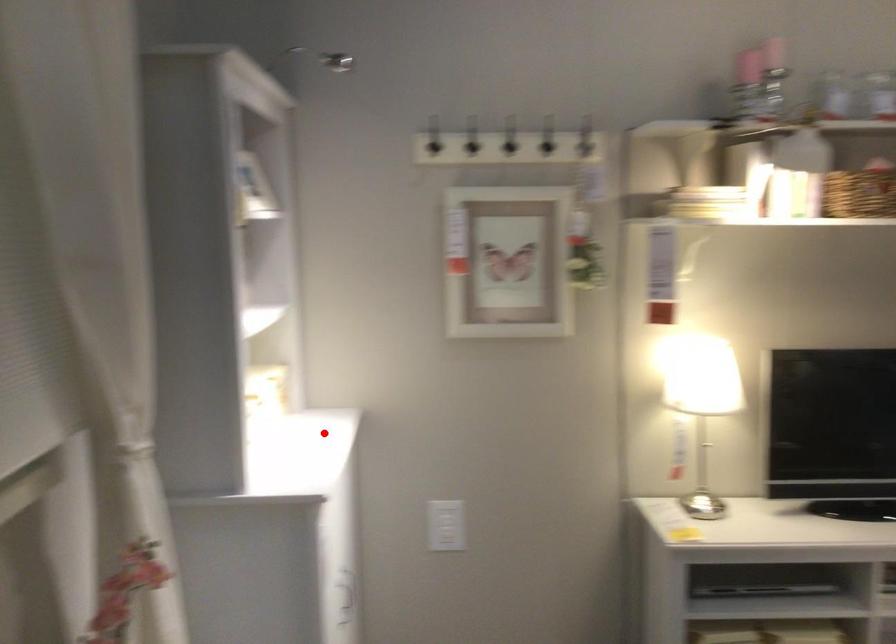
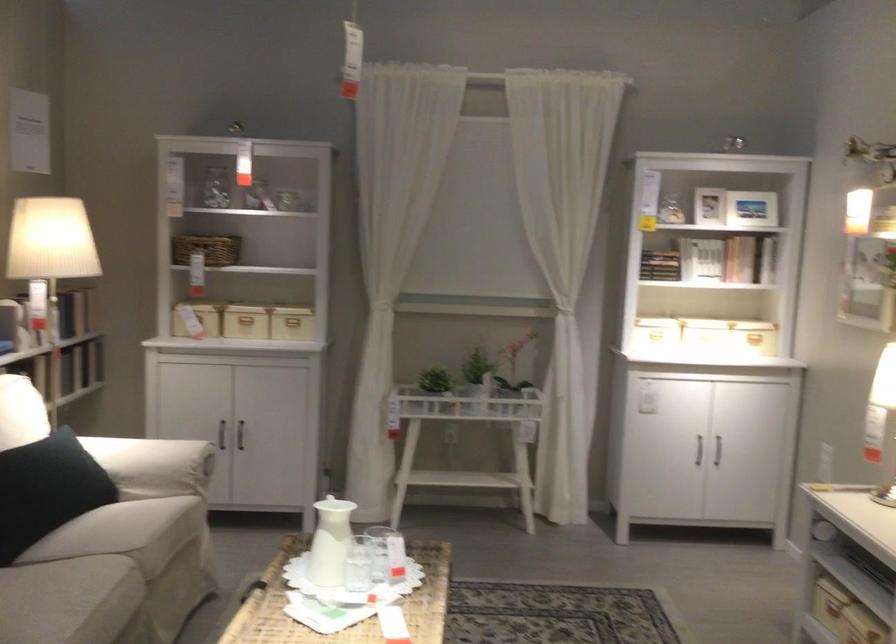
The point at the highlighted location is marked in the first image. Where is the corresponding point in the second image?

(755, 339)